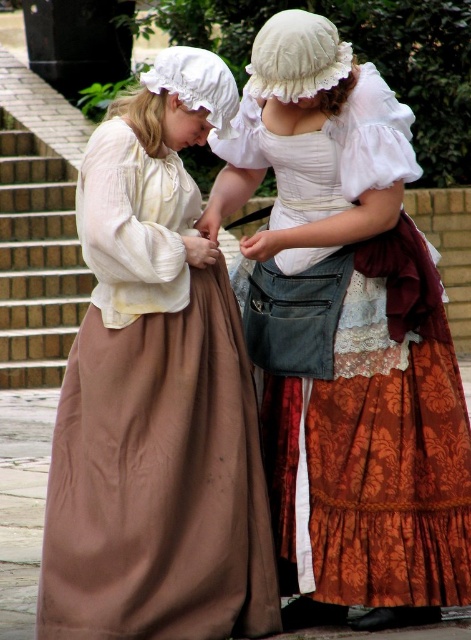
Question: Considering the relative positions of matte brown skirt at center and brick at left in the image provided, where is matte brown skirt at center located with respect to brick at left?

Choices:
 (A) below
 (B) above

Answer: (A)

Question: Which point is closer to the camera taking this photo?

Choices:
 (A) (105, 452)
 (B) (37, 211)

Answer: (A)

Question: Estimate the real-world distances between objects in this image. Which object is farther from the brick at left?

Choices:
 (A) matte white blouse at center
 (B) matte brown skirt at center

Answer: (B)

Question: Does matte white blouse at center have a smaller size compared to brick at left?

Choices:
 (A) yes
 (B) no

Answer: (B)

Question: Is matte white blouse at center positioned at the back of matte brown skirt at center?

Choices:
 (A) yes
 (B) no

Answer: (A)

Question: Which of the following is the closest to the observer?

Choices:
 (A) (2, 112)
 (B) (243, 253)

Answer: (B)